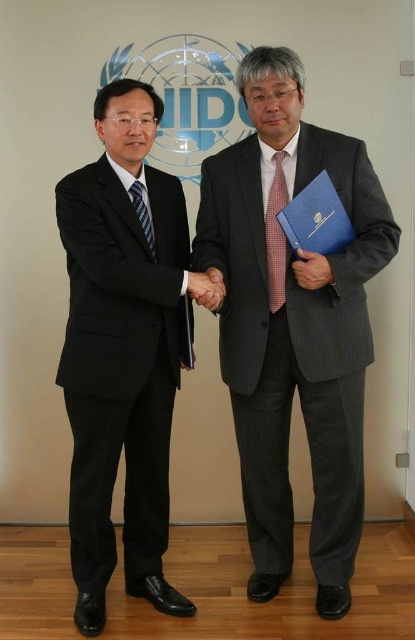
Question: Is black matte suit at left closer to the viewer compared to matte black folder at center?

Choices:
 (A) no
 (B) yes

Answer: (B)

Question: Does gray pinstripe suit at center appear under black matte suit at left?

Choices:
 (A) yes
 (B) no

Answer: (B)

Question: Among these objects, which one is nearest to the camera?

Choices:
 (A) matte black folder at center
 (B) gray pinstripe suit at center
 (C) black matte suit at left

Answer: (B)

Question: Can you confirm if black matte suit at left is positioned above matte black folder at center?

Choices:
 (A) yes
 (B) no

Answer: (B)

Question: Which point is farther to the camera?

Choices:
 (A) (222, 321)
 (B) (141, 218)
 (C) (105, 348)

Answer: (A)

Question: Among these objects, which one is farthest from the camera?

Choices:
 (A) smooth skin handshake at center
 (B) red checkered tie at center
 (C) black matte suit at left
 (D) matte black folder at center

Answer: (B)